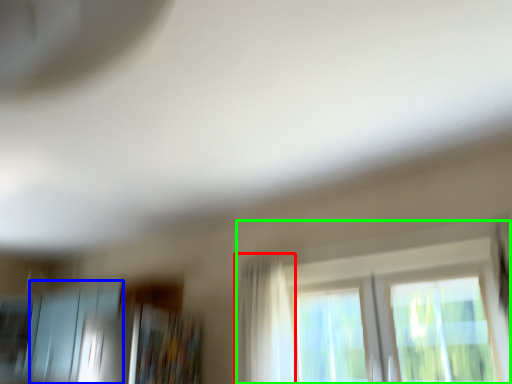
Question: Based on their relative distances, which object is nearer to curtain (highlighted by a red box)? Choose from screen door (highlighted by a blue box) and window (highlighted by a green box).

Choices:
 (A) screen door
 (B) window

Answer: (B)